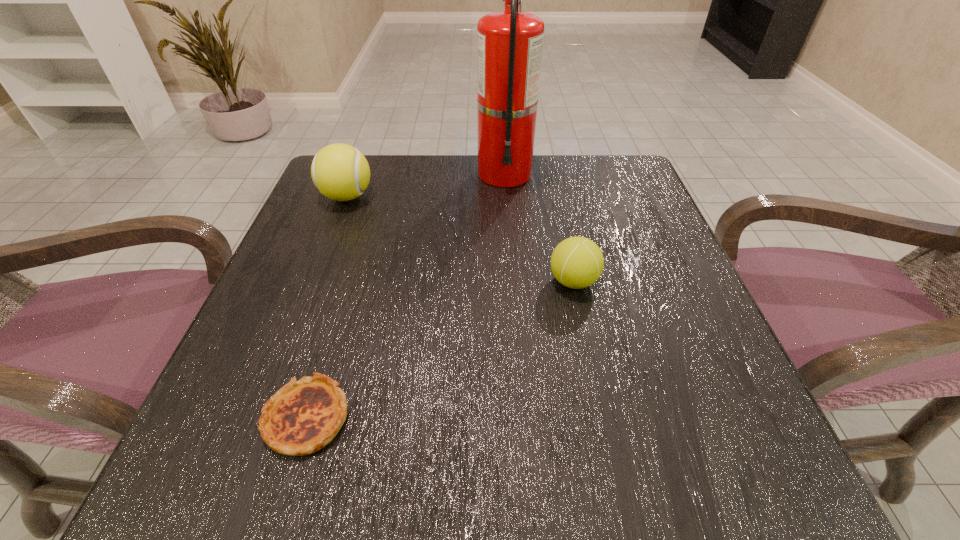
Find the location of a particular element. the tallest object is located at coordinates (509, 43).

Identify the location of the taller tennis ball. pos(340,172).

You are a GUI agent. You are given a task and a screenshot of the screen. Output one action in this format:
    pyautogui.click(x=<x>, y=<y>)
    Task: Click on the left tennis ball
    This screenshot has width=960, height=540.
    Given the screenshot: What is the action you would take?
    pyautogui.click(x=340, y=172)

At what (x,y) coordinates should I click in order to perform the action: click on the nearer tennis ball. Please return your answer as a coordinate pair (x, y). Looking at the image, I should click on (577, 262).

In order to click on the second nearest object in this screenshot , I will do [x=577, y=262].

What are the coordinates of `quiche` in the screenshot? It's located at (303, 416).

Where is `the nearest object`? the nearest object is located at coordinates (303, 416).

Where is `free space located at the nozzle of the fire extinguisher`? free space located at the nozzle of the fire extinguisher is located at coordinates (508, 222).

This screenshot has height=540, width=960. I want to click on vacant position located 0.150m on the front of the farther tennis ball, so click(323, 260).

Where is `vacant point located on the right of the third tallest object`? The width and height of the screenshot is (960, 540). vacant point located on the right of the third tallest object is located at coordinates pos(660,281).